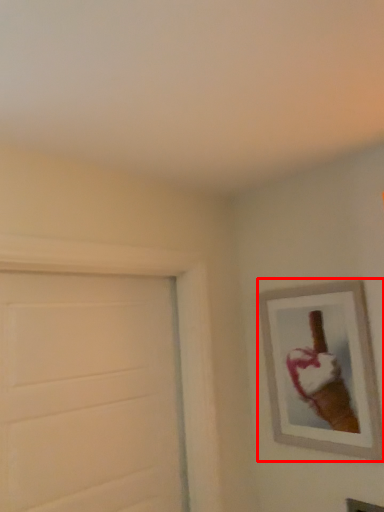
Question: From the image's perspective, where is picture frame (annotated by the red box) located in relation to door in the image?

Choices:
 (A) below
 (B) above

Answer: (B)